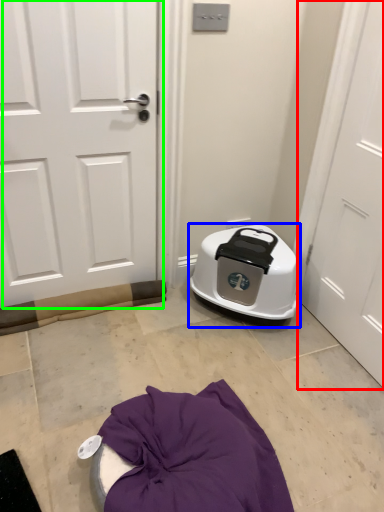
Question: Based on their relative distances, which object is nearer to door (highlighted by a red box)? Choose from appliance (highlighted by a blue box) and door (highlighted by a green box).

Choices:
 (A) appliance
 (B) door

Answer: (A)